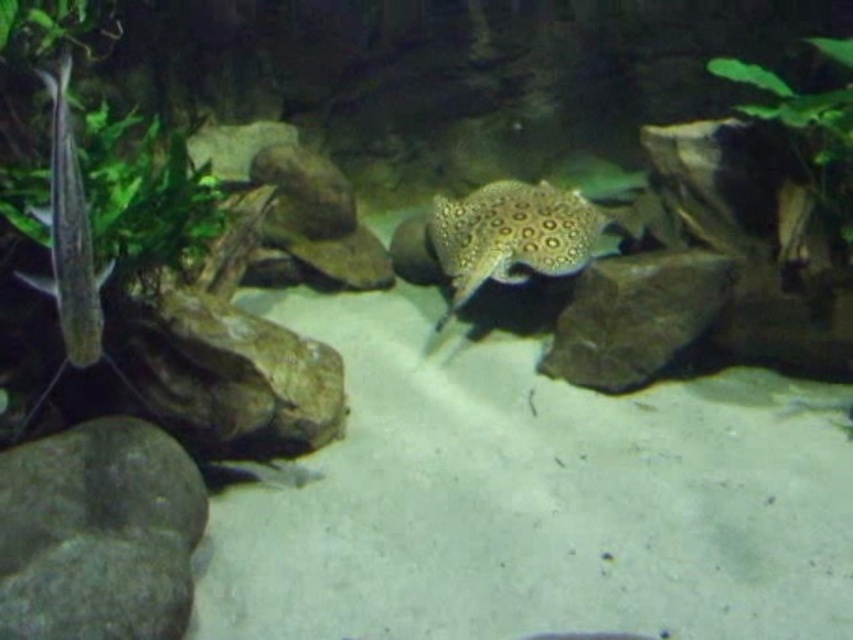
You are an underwater photographer aiming to capture both the smooth gray rock at left and the translucent white fish at left in a single frame. Given that your camera can only focus on objects within a 30 cm width, can you fit both objects side by side without cropping?

The smooth gray rock at left is wider than the translucent white fish at left. Since the camera can focus on objects within a 30 cm width, but the combined width of both objects may exceed this limit, it depends on their exact sizes. However, the description only states the rock is larger, not the total width. Without specific measurements, it is uncertain if they can fit together within the 30 cm frame.

You are an underwater photographer aiming to capture both the smooth gray rock at center and the translucent white fish at left in a single frame. Given that your camera has a fixed focal length, which object should you position closer to ensure both fit in the frame?

Since the smooth gray rock at center is wider than the translucent white fish at left, positioning the wider smooth gray rock at center closer to the camera will allow both objects to fit within the frame while maintaining their relative sizes.

You are an underwater photographer aiming to capture a photo of the stingray while ensuring both green leafy plant at left and green leafy plant at upper right are visible in the frame. Which plant should you position closer to the camera to ensure the stingray remains the main focus?

You should position the green leafy plant at upper right closer to the camera because it is taller than the green leafy plant at left, allowing it to be more visible while keeping the stingray as the main focus.